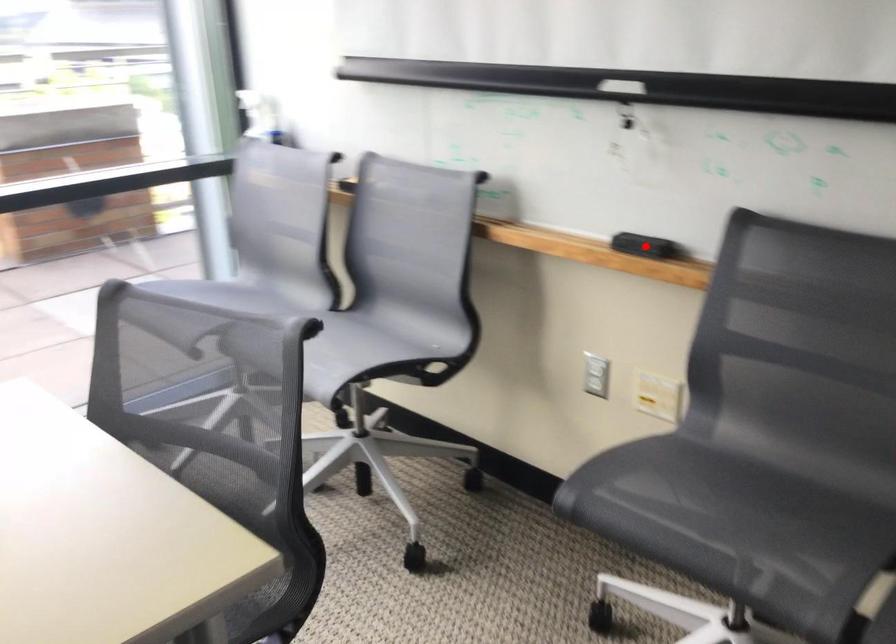
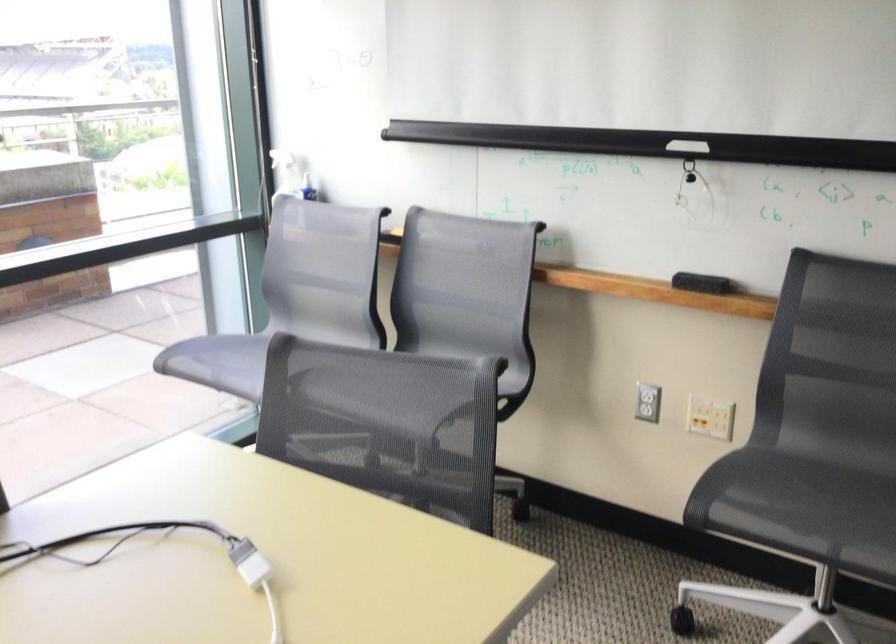
In the second image, find the point that corresponds to the highlighted location in the first image.

(701, 283)